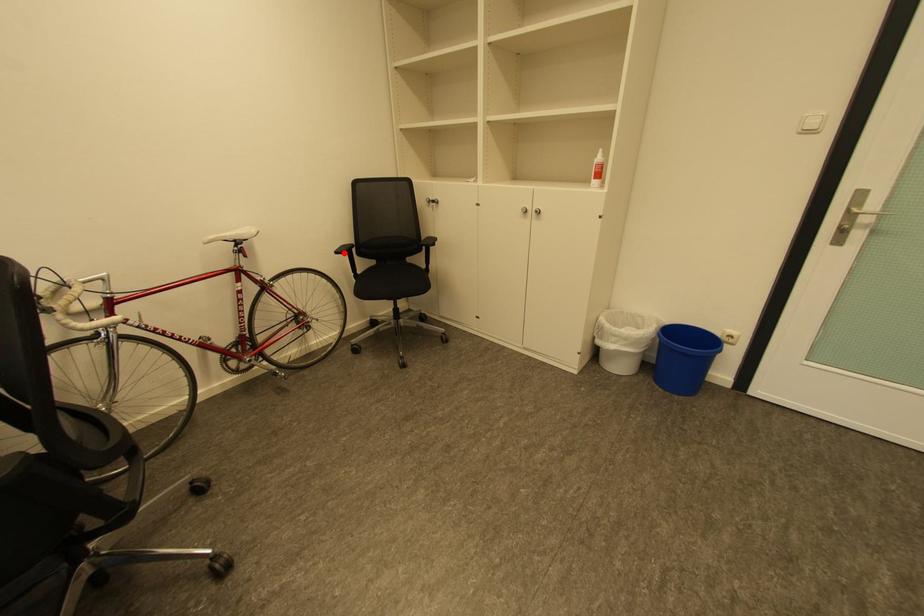
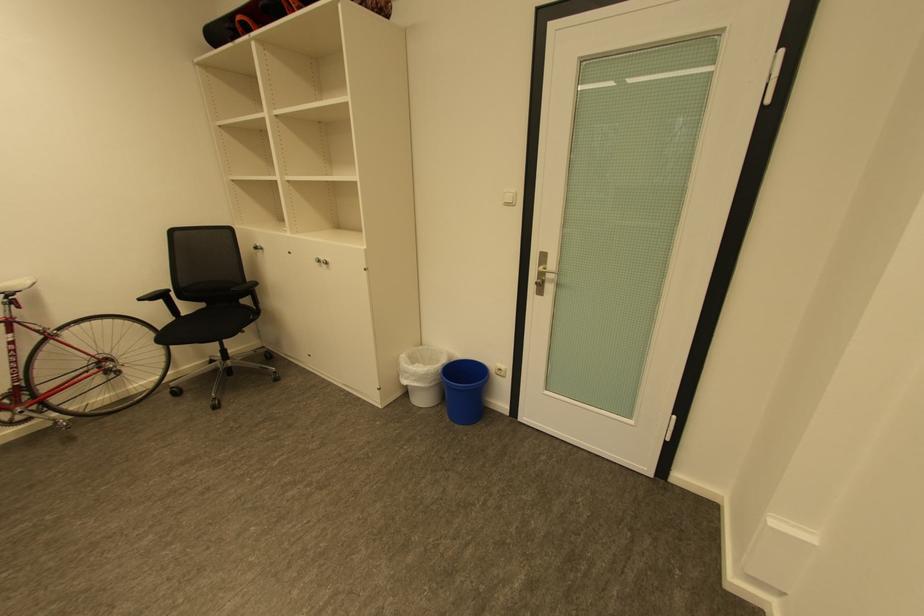
Question: I am providing you with two images of the same scene from different viewpoints. Image1 has a red point marked. In image2, the corresponding 3D location appears at what relative position? Reply with the corresponding letter.

Choices:
 (A) Closer
 (B) Farther

Answer: (B)